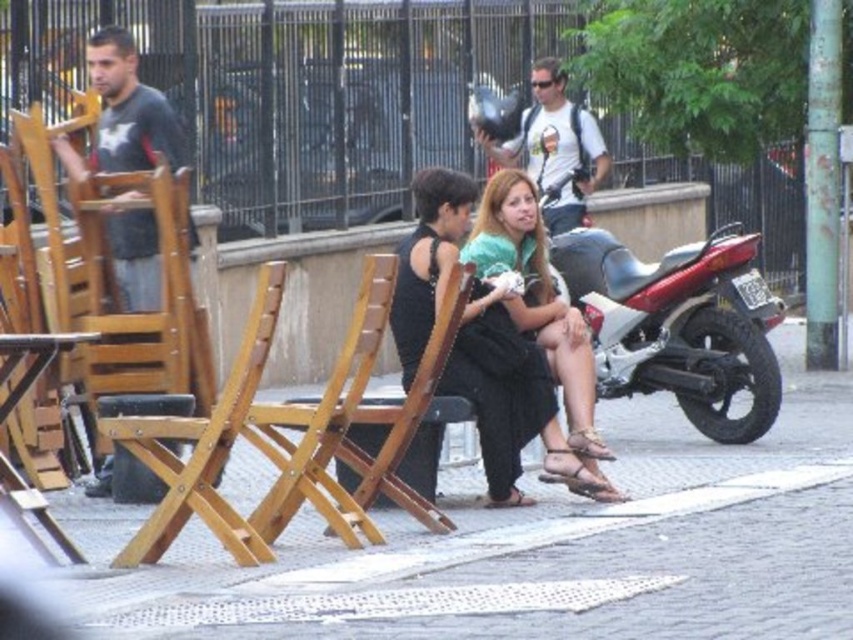
Does matte green dress at center have a lesser width compared to matte black camera at upper center?

Indeed, matte green dress at center has a lesser width compared to matte black camera at upper center.

Which is in front, point (546, 291) or point (567, 141)?

Positioned in front is point (546, 291).

Locate an element on the screen. This screenshot has width=853, height=640. matte green dress at center is located at coordinates (543, 326).

Does smooth concrete pavement at center appear on the left side of matte black camera at upper center?

Incorrect, smooth concrete pavement at center is not on the left side of matte black camera at upper center.

Does smooth concrete pavement at center lie behind matte black camera at upper center?

No, it is in front of matte black camera at upper center.

What do you see at coordinates (521, 548) in the screenshot?
I see `smooth concrete pavement at center` at bounding box center [521, 548].

Where is `smooth concrete pavement at center`? The height and width of the screenshot is (640, 853). smooth concrete pavement at center is located at coordinates (521, 548).

Consider the image. Can you confirm if smooth concrete pavement at center is taller than dark gray fabric shirt at left?

Incorrect, smooth concrete pavement at center's height is not larger of dark gray fabric shirt at left's.

Does smooth concrete pavement at center have a larger size compared to dark gray fabric shirt at left?

Incorrect, smooth concrete pavement at center is not larger than dark gray fabric shirt at left.

Is point (786, 624) farther from viewer compared to point (151, 104)?

No.

The height and width of the screenshot is (640, 853). I want to click on smooth concrete pavement at center, so click(521, 548).